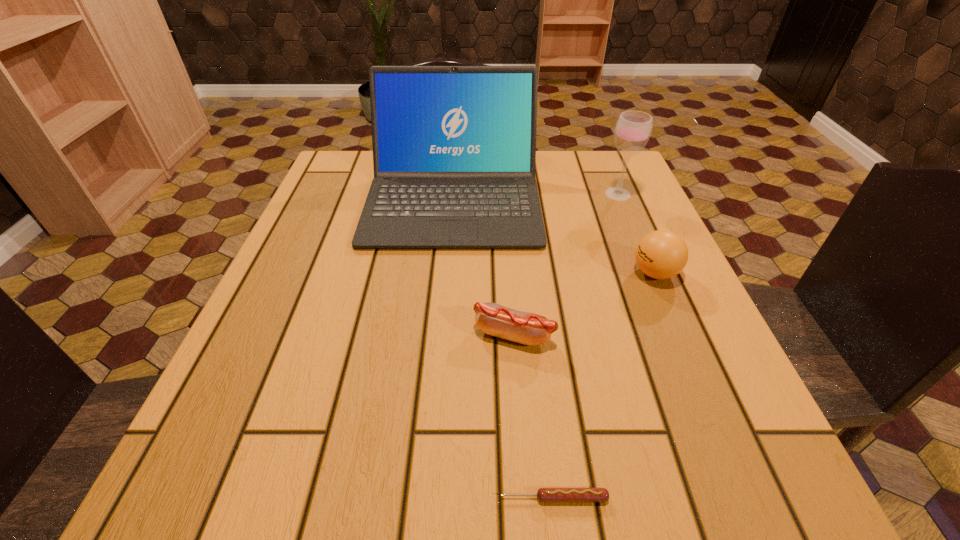
Locate an element on the screen. The height and width of the screenshot is (540, 960). free location located 0.290m on the side with brand of the third nearest object is located at coordinates pyautogui.click(x=478, y=273).

Identify the location of blank space located on the side with brand of the third nearest object. (547, 273).

Identify the location of vacant space situated 0.190m on the side with brand of the third nearest object. [531, 273].

The height and width of the screenshot is (540, 960). I want to click on vacant point located on the back of the second nearest object, so (x=510, y=281).

What are the coordinates of `vacant space located 0.350m on the left of the shorter sausage` in the screenshot? It's located at (214, 498).

The image size is (960, 540). Find the location of `laptop computer located in the far edge section of the desktop`. laptop computer located in the far edge section of the desktop is located at coordinates (454, 147).

Identify the location of wineglass at the far edge. (633, 129).

Where is `object located in the near edge section of the desktop`? This screenshot has height=540, width=960. object located in the near edge section of the desktop is located at coordinates (545, 495).

At what (x,y) coordinates should I click in order to perform the action: click on object that is at the left edge. Please return your answer as a coordinate pair (x, y). This screenshot has width=960, height=540. Looking at the image, I should click on (454, 147).

Where is `wineglass at the right edge`? wineglass at the right edge is located at coordinates (633, 129).